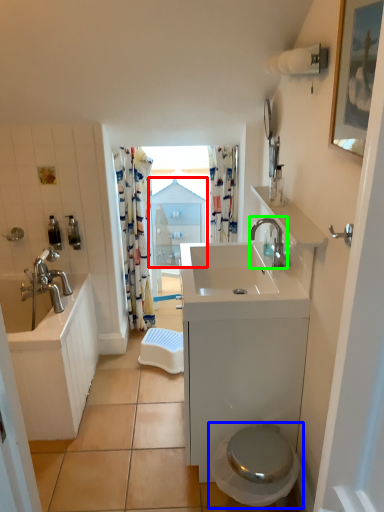
Question: Estimate the real-world distances between objects in this image. Which object is farther from medicine cabinet (highlighted by a red box), toilet (highlighted by a blue box) or tap (highlighted by a green box)?

Choices:
 (A) toilet
 (B) tap

Answer: (A)